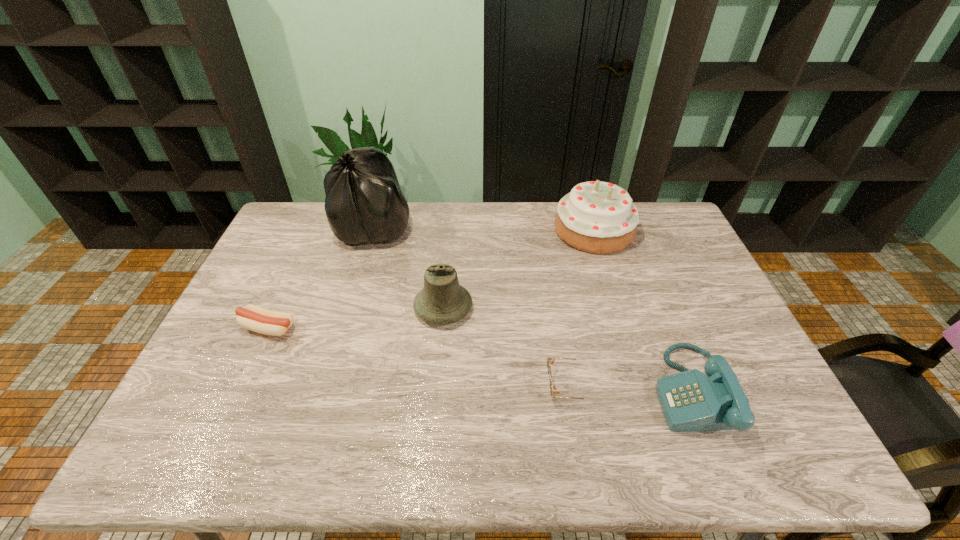
I want to click on plastic bag, so pyautogui.click(x=364, y=203).

Where is `cake`? cake is located at coordinates (596, 217).

What are the coordinates of `the third object from left to right` in the screenshot? It's located at (442, 301).

Image resolution: width=960 pixels, height=540 pixels. Identify the location of the fourth shortest object. (442, 301).

What are the coordinates of `the third shortest object` in the screenshot? It's located at (690, 400).

Locate an element on the screen. This screenshot has height=540, width=960. sunglasses is located at coordinates coord(554,392).

Where is `sausage`? The height and width of the screenshot is (540, 960). sausage is located at coordinates (254, 318).

This screenshot has width=960, height=540. I want to click on vacant space located on the right of the tallest object, so click(507, 225).

Identify the location of blank space located 0.230m on the left of the cake. (491, 230).

This screenshot has width=960, height=540. Find the location of `vacant space located on the front of the bell`. vacant space located on the front of the bell is located at coordinates (436, 392).